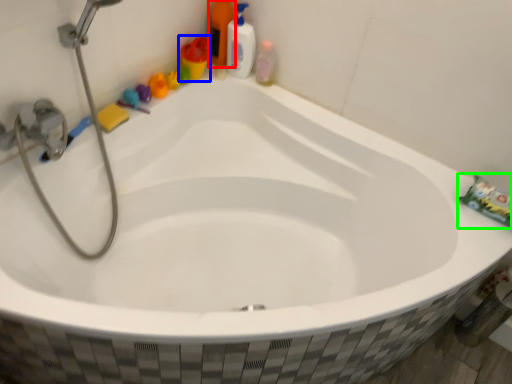
Question: Estimate the real-world distances between objects in this image. Which object is closer to cleaning product (highlighted by a red box), toiletry (highlighted by a blue box) or toothpaste (highlighted by a green box)?

Choices:
 (A) toiletry
 (B) toothpaste

Answer: (A)